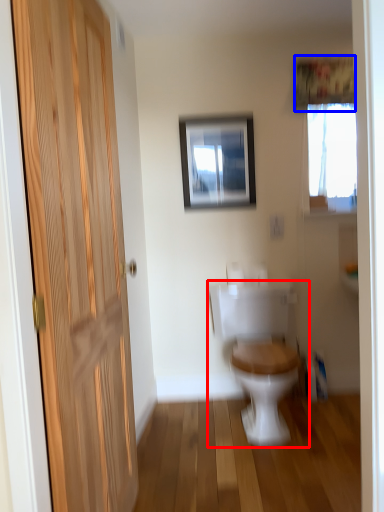
Question: Which point is closer to the camera, toilet (highlighted by a red box) or curtain (highlighted by a blue box)?

Choices:
 (A) toilet
 (B) curtain

Answer: (A)